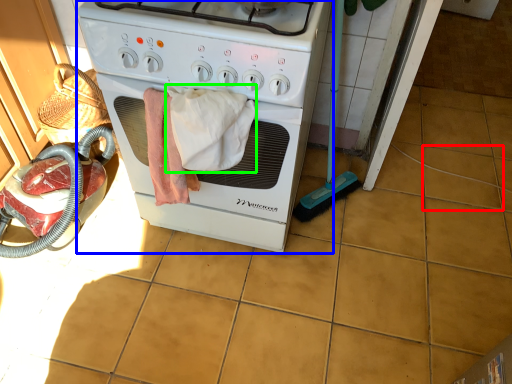
Question: Which is nearer to the tile (highlighted by a red box)? home appliance (highlighted by a blue box) or bath towel (highlighted by a green box).

Choices:
 (A) home appliance
 (B) bath towel

Answer: (A)